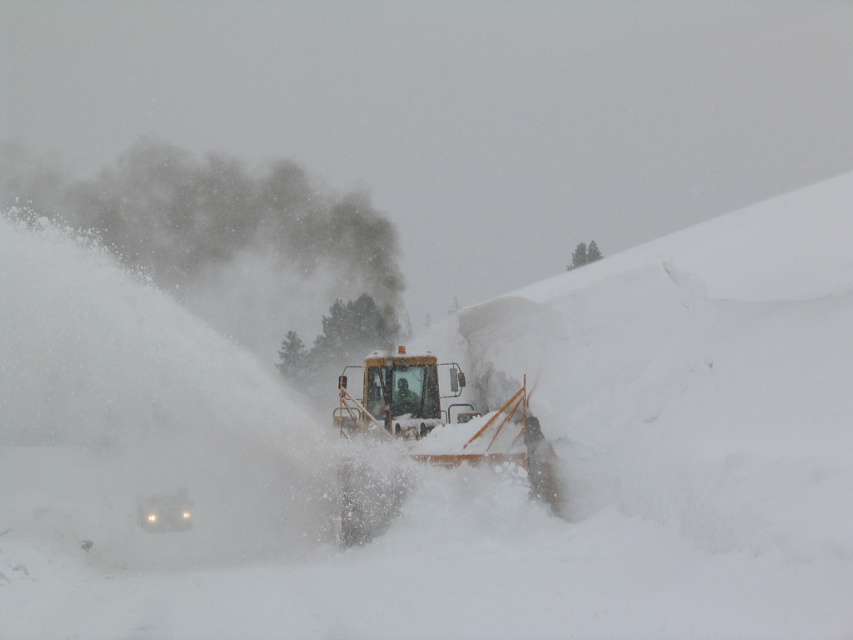
You are a city planner assessing the snowplow operation in the image. The snowplow is clearing snow from the road. Based on the scene, can you determine if the white powdery snow at center is above or below the yellow metallic snowplow at center?

The white powdery snow at center is located above the yellow metallic snowplow at center according to the description.

You are a pedestrian trying to cross the road and see the white powdery snow at center and the yellow metallic snowplow at center. Which object is closer to the left side of the road?

The white powdery snow at center is to the left of the yellow metallic snowplow at center, so it is closer to the left side of the road.